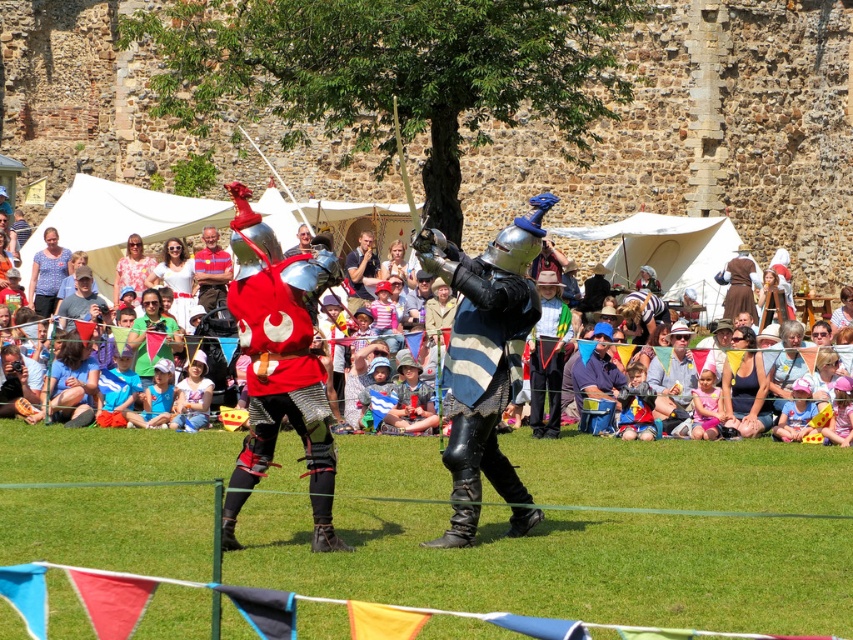
Is shiny silver armor at center taller than matte silver helmet at center?

Yes, shiny silver armor at center is taller than matte silver helmet at center.

Which of these two, shiny silver armor at center or matte silver helmet at center, stands shorter?

With less height is matte silver helmet at center.

Between point (521, 252) and point (286, 209), which one is positioned in front?

Point (521, 252) is more forward.

Identify the location of shiny silver armor at center. Image resolution: width=853 pixels, height=640 pixels. (485, 356).